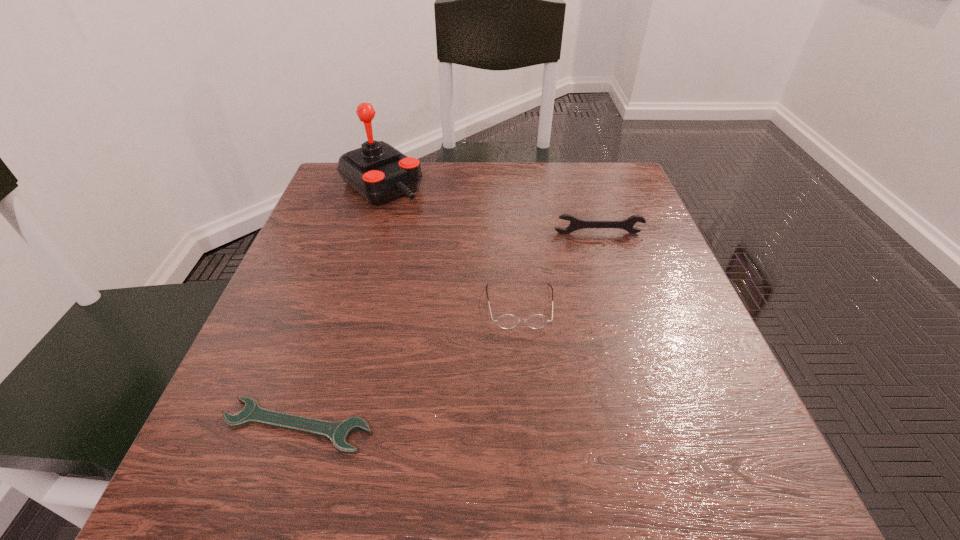
What are the coordinates of `vacant point located through the lenses of the third farthest object` in the screenshot? It's located at (538, 502).

Where is `free space located 0.140m on the right of the shorter wrench`? free space located 0.140m on the right of the shorter wrench is located at coordinates coord(472,426).

You are a GUI agent. You are given a task and a screenshot of the screen. Output one action in this format:
    pyautogui.click(x=<x>, y=<y>)
    Task: Click on the object at the far edge
    
    Given the screenshot: What is the action you would take?
    pyautogui.click(x=377, y=171)

The height and width of the screenshot is (540, 960). I want to click on object present at the near edge, so click(x=338, y=432).

Locate an element on the screen. The width and height of the screenshot is (960, 540). joystick at the left edge is located at coordinates (377, 171).

Find the location of a particular element. wrench present at the left edge is located at coordinates (338, 432).

The height and width of the screenshot is (540, 960). Find the location of `object present at the right edge`. object present at the right edge is located at coordinates (575, 224).

Find the location of a particular element. object at the far left corner is located at coordinates (377, 171).

Identify the location of object positioned at the near left corner. The image size is (960, 540). (338, 432).

Locate an element on the screen. vacant region at the far edge of the desktop is located at coordinates (491, 166).